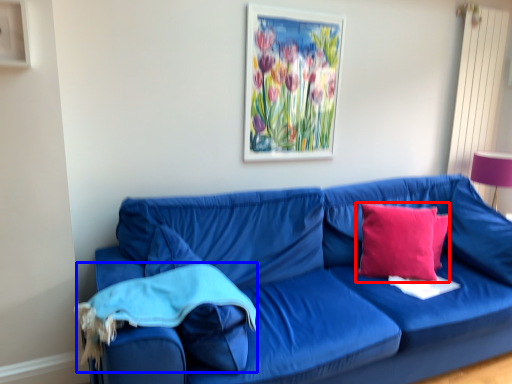
Question: Which of the following is the closest to the observer, pillow (highlighted by a red box) or material (highlighted by a blue box)?

Choices:
 (A) pillow
 (B) material

Answer: (B)